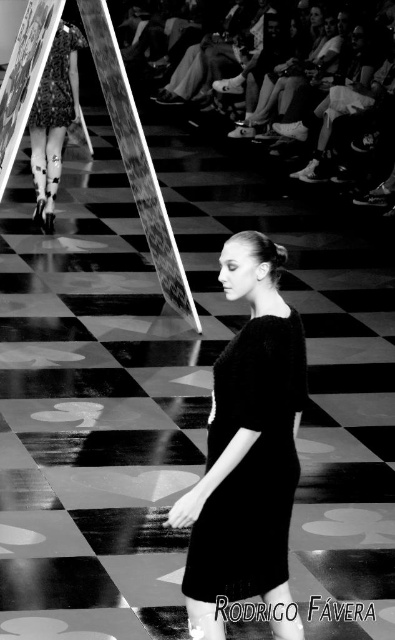
Can you confirm if matte black dress at center is bigger than printed fabric dress at left?

No, matte black dress at center is not bigger than printed fabric dress at left.

Between point (255, 566) and point (50, 147), which one is positioned in front?

Point (255, 566)

Where is `matte black dress at center`? matte black dress at center is located at coordinates (250, 464).

Who is positioned more to the left, matte black dress at center or printed fabric dress at upper left?

printed fabric dress at upper left is more to the left.

Locate an element on the screen. matte black dress at center is located at coordinates (250, 464).

Find the location of `matte black dress at center`. matte black dress at center is located at coordinates (250, 464).

Which is more to the right, printed fabric dress at left or printed fabric dress at upper left?

printed fabric dress at upper left

Who is more distant from viewer, (73,32) or (39,96)?

Positioned behind is point (39,96).

Identify the location of printed fabric dress at left. This screenshot has height=640, width=395. (54, 118).